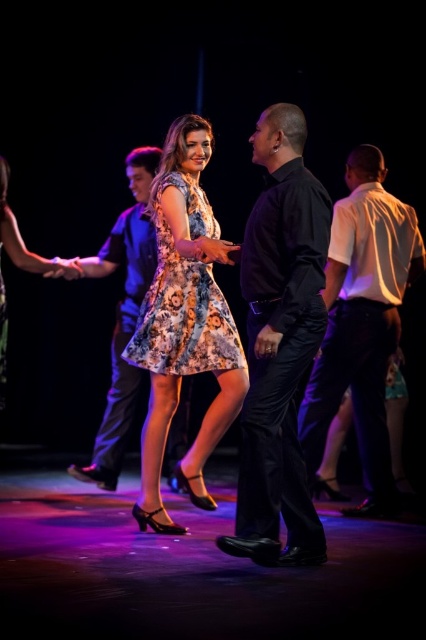
Question: From the image, what is the correct spatial relationship of white cotton shirt at right in relation to floral-patterned fabric dress at center?

Choices:
 (A) left
 (B) right

Answer: (B)

Question: Which point appears closest to the camera in this image?

Choices:
 (A) (172, 243)
 (B) (330, 339)
 (C) (195, 196)

Answer: (A)

Question: Which point is farther to the camera?

Choices:
 (A) black satin shirt at center
 (B) matte black shirt at center
 (C) white cotton shirt at right
 (D) floral-patterned fabric dress at center

Answer: (B)

Question: Which point appears closest to the camera in this image?

Choices:
 (A) (144, 337)
 (B) (129, 300)
 (C) (281, 259)
 (D) (154, 413)

Answer: (C)

Question: Is black satin shirt at center below white cotton shirt at right?

Choices:
 (A) yes
 (B) no

Answer: (A)

Question: Is floral-patterned dress at center positioned behind floral-patterned fabric dress at center?

Choices:
 (A) no
 (B) yes

Answer: (A)